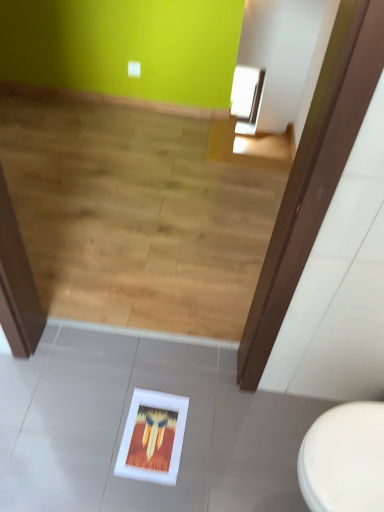
You are a GUI agent. You are given a task and a screenshot of the screen. Output one action in this format:
    pyautogui.click(x=<x>, y=<y>)
    Task: Click on the blank space above wooden floor at lower center (from a real-world perspective)
    
    Given the screenshot: What is the action you would take?
    point(138,175)